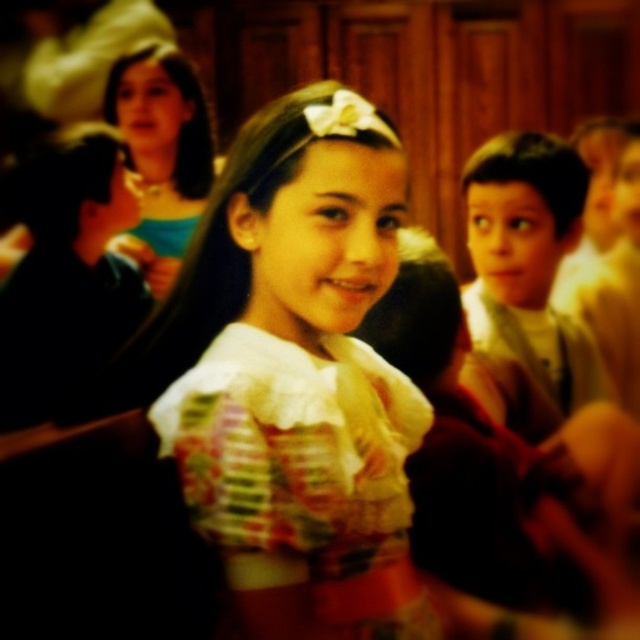
Question: Can you confirm if white lace dress at center is positioned above light brown hair at right?

Choices:
 (A) yes
 (B) no

Answer: (B)

Question: Which point is farther from the camera taking this photo?

Choices:
 (A) (392, 524)
 (B) (417, 536)

Answer: (B)

Question: Which object is farther from the camera taking this photo?

Choices:
 (A) white lace dress at center
 (B) matte floral dress at center

Answer: (B)

Question: Which of these objects is positioned farthest from the matte floral dress at center?

Choices:
 (A) white lace dress at center
 (B) light brown hair at right

Answer: (B)

Question: Is matte floral dress at center above light brown hair at right?

Choices:
 (A) yes
 (B) no

Answer: (B)

Question: Does white lace dress at center have a greater width compared to light brown hair at right?

Choices:
 (A) yes
 (B) no

Answer: (A)